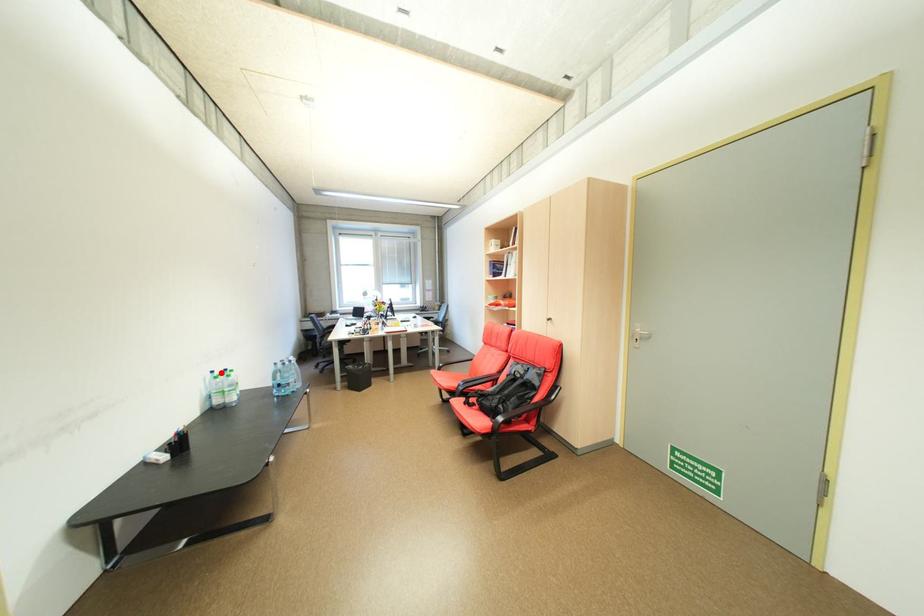
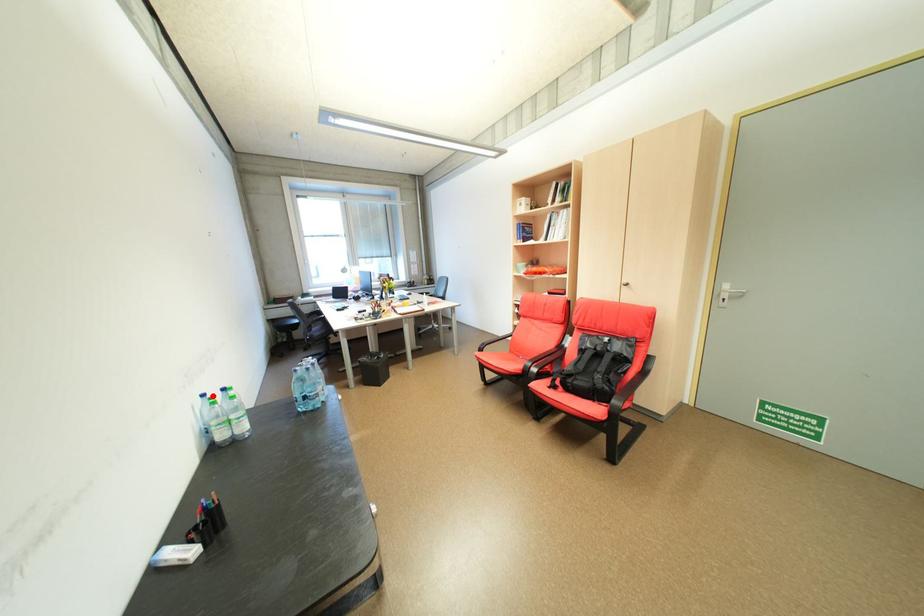
I am providing you with two images of the same scene from different viewpoints. A red point is marked on the first image and another point is marked on the second image. Does the point marked in image1 correspond to the same location as the one in image2?

Yes